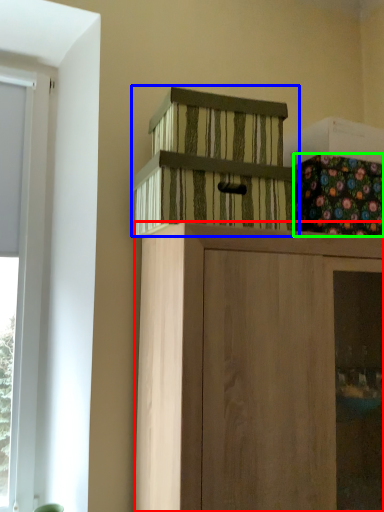
Question: Considering the real-world distances, which object is closest to cabinetry (highlighted by a red box)? cabinetry (highlighted by a blue box) or flower (highlighted by a green box).

Choices:
 (A) cabinetry
 (B) flower

Answer: (A)